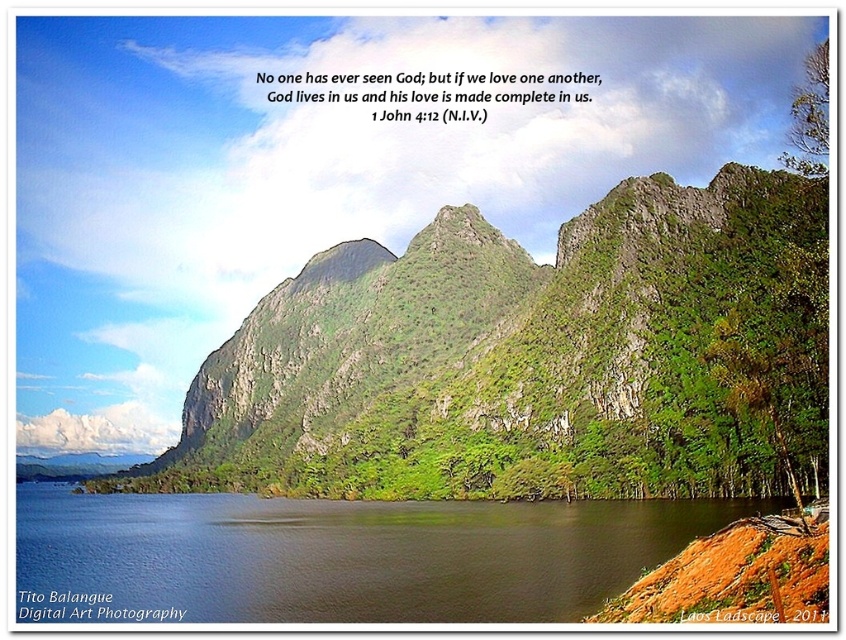
Between green rocky mountain at center and blue water at lower left, which one has less height?

Standing shorter between the two is blue water at lower left.

Which is behind, point (671, 237) or point (331, 509)?

The point (671, 237) is behind.

What are the coordinates of `green rocky mountain at center` in the screenshot? It's located at (536, 358).